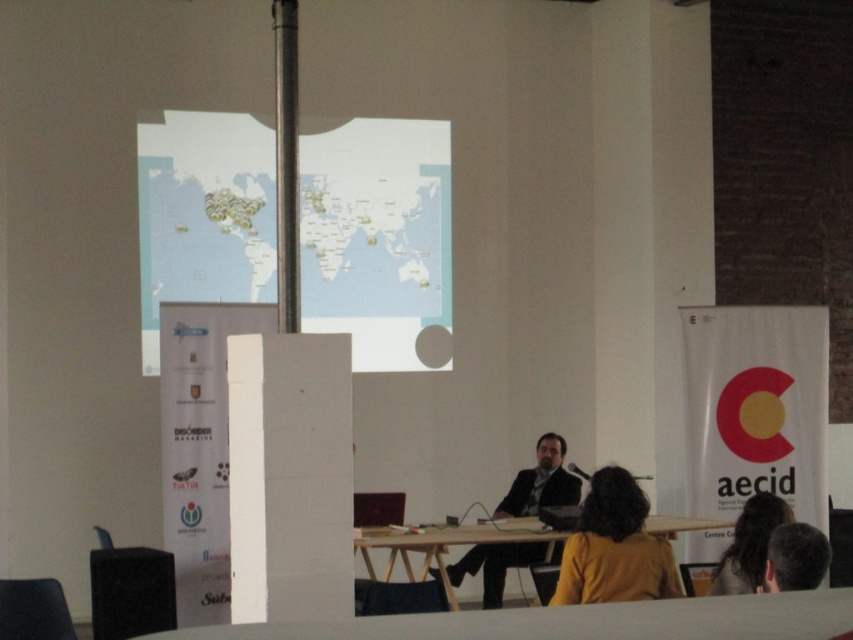
You are attending a presentation and need to place a 10cm wide notebook on the table. The table is represented by the wooden at center. Can you place the notebook at the point with coordinates of 0.852, 0.522 without overlapping other objects?

The wooden at center has a position at point (444, 545). Since the notebook is 10cm wide, it can be placed there as long as there are no other objects occupying that space. However, the description does not mention any overlapping objects at that coordinate, so it should be possible.

You are organizing a small event and need to place a 3.5 meter long banner between the dark suit at center and the gray hair at upper right. Will there be enough space to fit the banner between them?

The dark suit at center is 3.72 meters from the gray hair at upper right, so yes, the banner can be placed between them since the distance is greater than the banner length.

You are an attendee at the presentation and want to approach the speaker. The speaker is at point (392, 557). There is an obstacle at point (544, 488). Can you walk directly from your current position to the speaker without going around the obstacle?

Point (392, 557) is in front of point (544, 488), so you can walk directly to the speaker at point (392, 557) without needing to go around the obstacle at point (544, 488) because the speaker is closer to you than the obstacle.